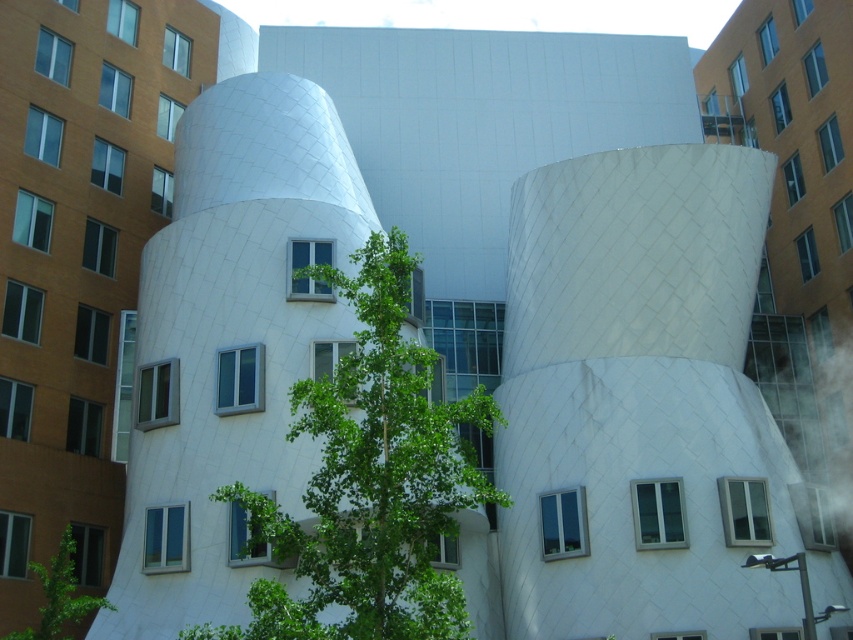
Who is shorter, green leafy tree at center or green leafy tree at lower left?

green leafy tree at lower left is shorter.

Is green leafy tree at center taller than green leafy tree at lower left?

Yes, green leafy tree at center is taller than green leafy tree at lower left.

Between point (392, 368) and point (21, 636), which one is positioned in front?

Positioned in front is point (392, 368).

You are a GUI agent. You are given a task and a screenshot of the screen. Output one action in this format:
    pyautogui.click(x=<x>, y=<y>)
    Task: Click on the green leafy tree at center
    The image size is (853, 640).
    Given the screenshot: What is the action you would take?
    pyautogui.click(x=370, y=480)